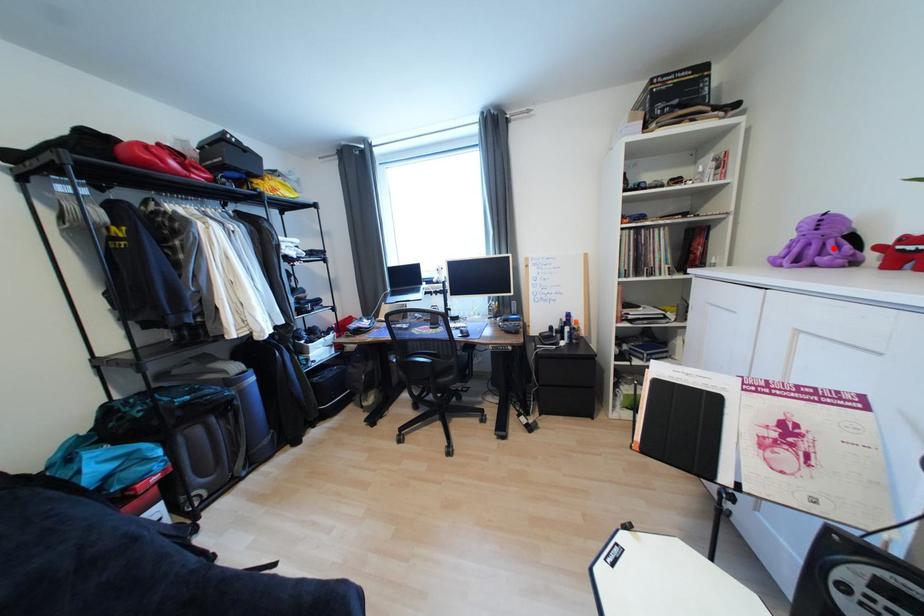
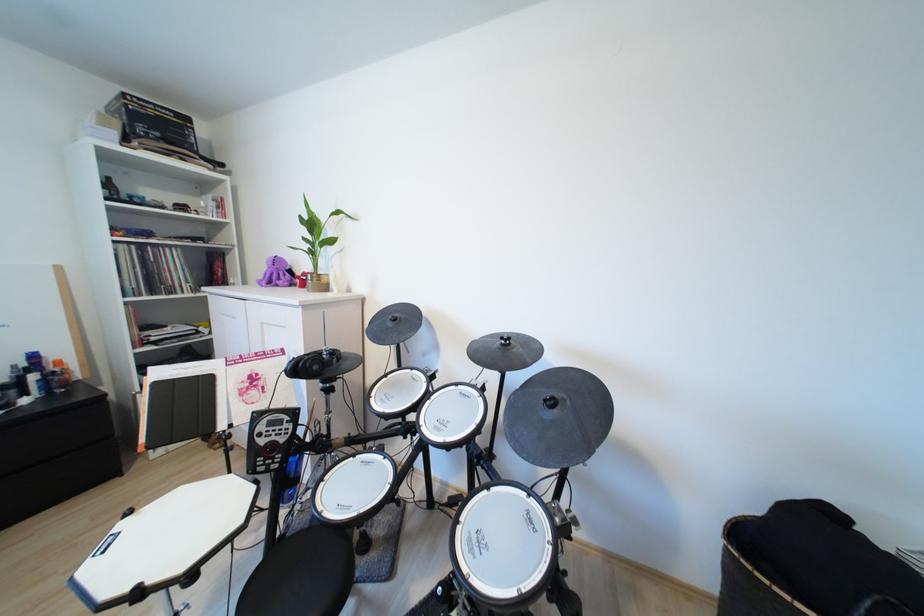
The point at the highlighted location is marked in the first image. Where is the corresponding point in the second image?

(289, 277)